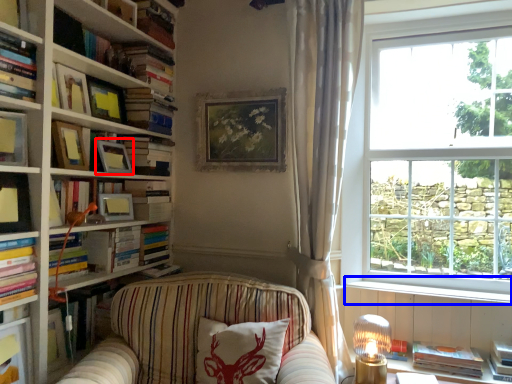
Question: Among these objects, which one is farthest to the camera, picture frame (highlighted by a red box) or window sill (highlighted by a blue box)?

Choices:
 (A) picture frame
 (B) window sill

Answer: (B)